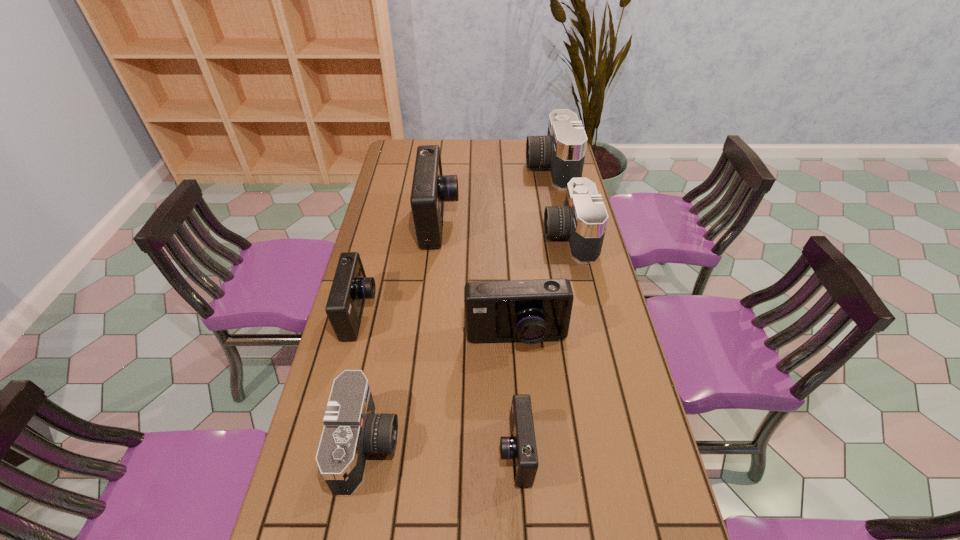
Where is `free space located 0.200m on the front-facing side of the smallest black camera`? free space located 0.200m on the front-facing side of the smallest black camera is located at coordinates (480, 444).

This screenshot has width=960, height=540. What are the coordinates of `vacant space located on the front-facing side of the smallest blue camera` in the screenshot? It's located at (405, 451).

Where is `free region located on the front-facing side of the smallest blue camera`? This screenshot has width=960, height=540. free region located on the front-facing side of the smallest blue camera is located at coordinates (372, 451).

Locate an element on the screen. Image resolution: width=960 pixels, height=540 pixels. free space located 0.300m on the front-facing side of the smallest blue camera is located at coordinates (375, 451).

At what (x,y) coordinates should I click in order to perform the action: click on object present at the far edge. Please return your answer as a coordinate pair (x, y). The width and height of the screenshot is (960, 540). Looking at the image, I should click on (563, 150).

You are a GUI agent. You are given a task and a screenshot of the screen. Output one action in this format:
    pyautogui.click(x=<x>, y=<y>)
    Task: Click on the object situated at the far right corner
    This screenshot has width=960, height=540.
    Given the screenshot: What is the action you would take?
    pyautogui.click(x=563, y=150)

Image resolution: width=960 pixels, height=540 pixels. I want to click on free spot at the far edge of the desktop, so click(465, 156).

Find the location of `free space at the left edge`. free space at the left edge is located at coordinates tap(344, 501).

Find the location of a particular element. free region at the right edge is located at coordinates (613, 346).

Identify the location of empty space that is in between the farthest black camera and the leftmost blue camera. The image size is (960, 540). (455, 240).